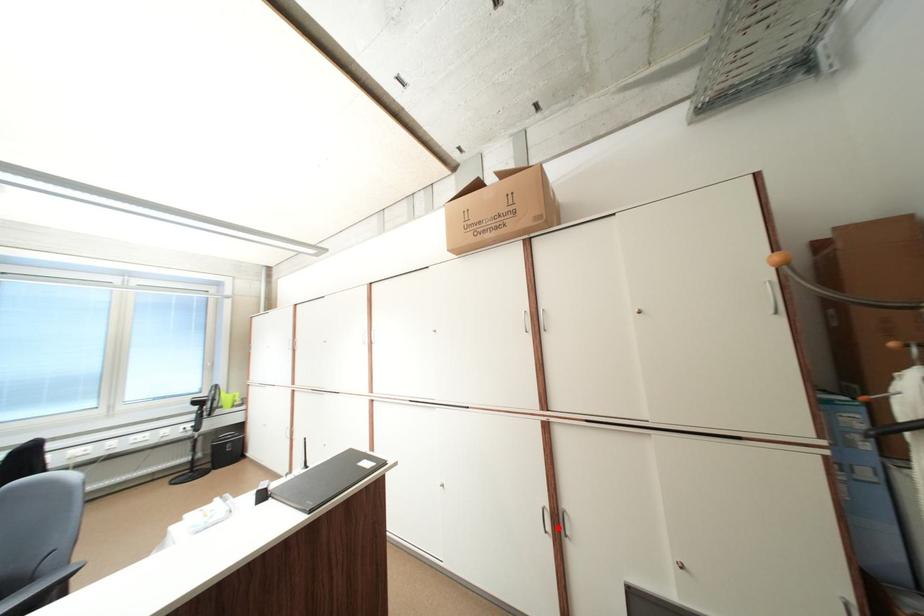
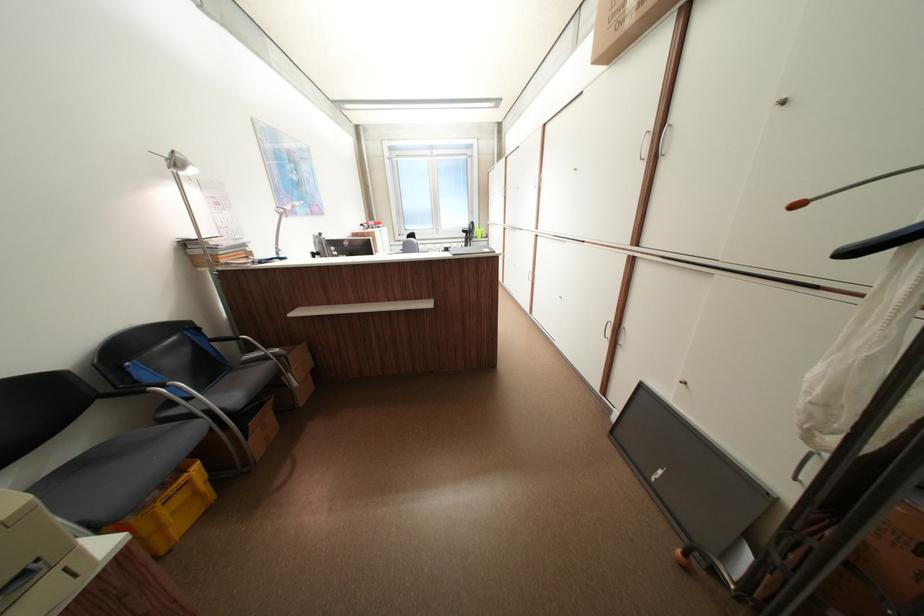
Question: I am providing you with two images of the same scene from different viewpoints. A red point is shown in image1. For the corresponding object point in image2, is it positioned nearer or farther from the camera?

Choices:
 (A) Nearer
 (B) Farther

Answer: (A)